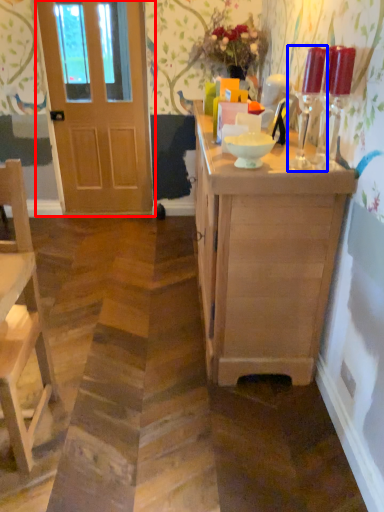
Question: Which point is further to the camera, door (highlighted by a red box) or candle holder (highlighted by a blue box)?

Choices:
 (A) door
 (B) candle holder

Answer: (A)